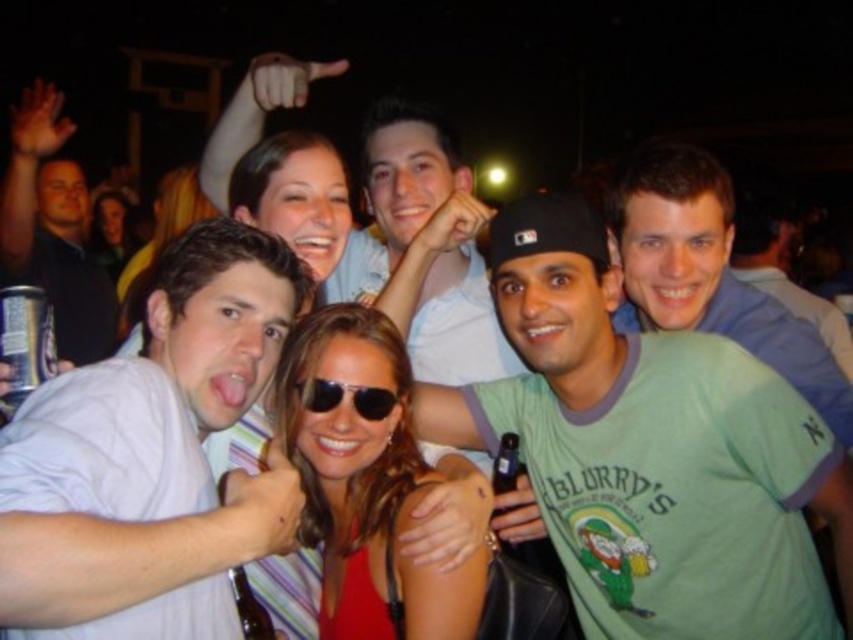
Can you confirm if green cotton t-shirt at center is positioned above white cotton shirt at center?

Actually, green cotton t-shirt at center is below white cotton shirt at center.

Which of these two, green cotton t-shirt at center or white cotton shirt at center, stands shorter?

white cotton shirt at center is shorter.

This screenshot has width=853, height=640. What do you see at coordinates (650, 451) in the screenshot?
I see `green cotton t-shirt at center` at bounding box center [650, 451].

This screenshot has width=853, height=640. In order to click on green cotton t-shirt at center in this screenshot , I will do `click(650, 451)`.

Which is in front, point (33, 176) or point (790, 250)?

Point (33, 176)

Does matte black can at left have a lesser width compared to green t-shirt at center?

Yes, matte black can at left is thinner than green t-shirt at center.

Locate an element on the screen. The width and height of the screenshot is (853, 640). matte black can at left is located at coordinates (53, 227).

Is green cotton shirt at center smaller than matte black can at left?

Indeed, green cotton shirt at center has a smaller size compared to matte black can at left.

Is green cotton shirt at center further to the viewer compared to matte black can at left?

No, it is in front of matte black can at left.

Is point (682, 284) closer to viewer compared to point (22, 164)?

Yes, it is in front of point (22, 164).

Identify the location of green cotton shirt at center. The width and height of the screenshot is (853, 640). (709, 273).